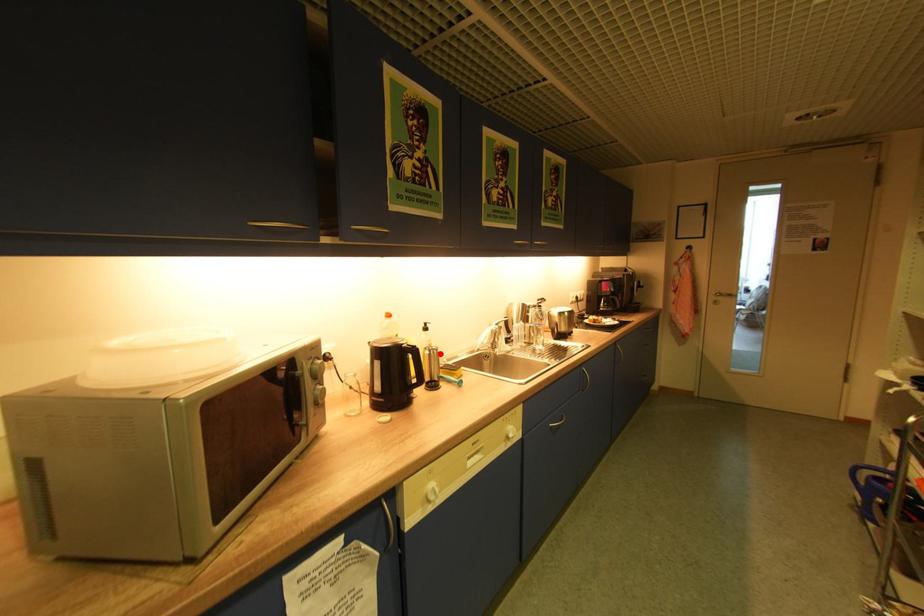
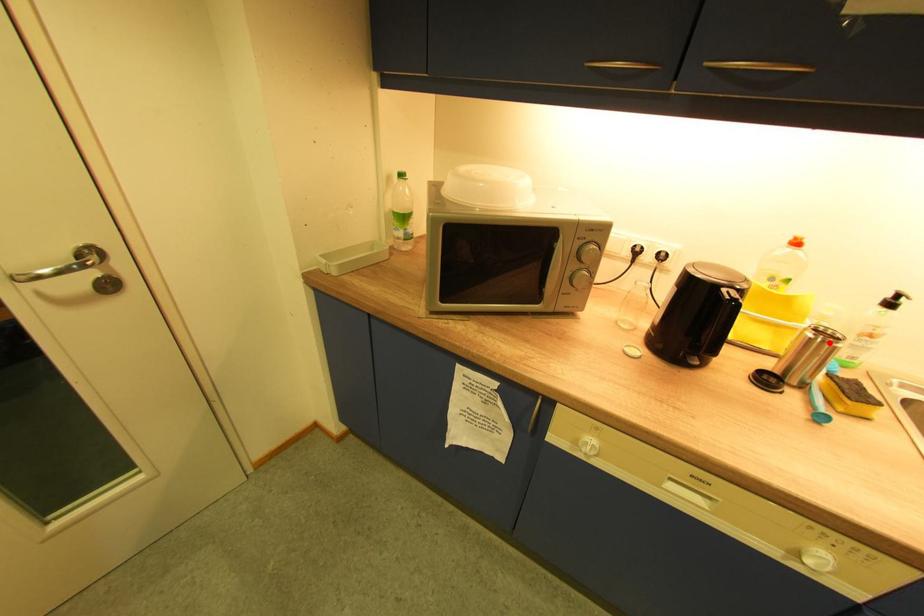
I am providing you with two images of the same scene from different viewpoints. A red point is marked on the first image and another point is marked on the second image. Is the marked point in image1 the same physical position as the marked point in image2?

Yes